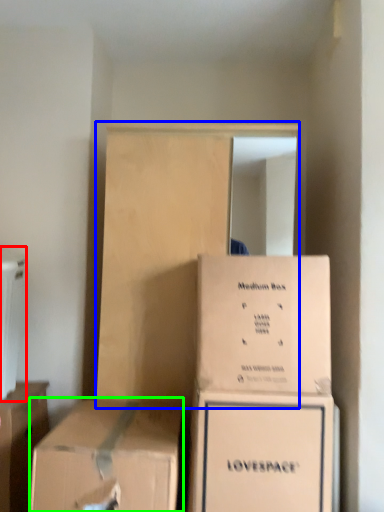
Question: Based on their relative distances, which object is nearer to appliance (highlighted by a red box)? Choose from dresser (highlighted by a blue box) and box (highlighted by a green box).

Choices:
 (A) dresser
 (B) box

Answer: (A)